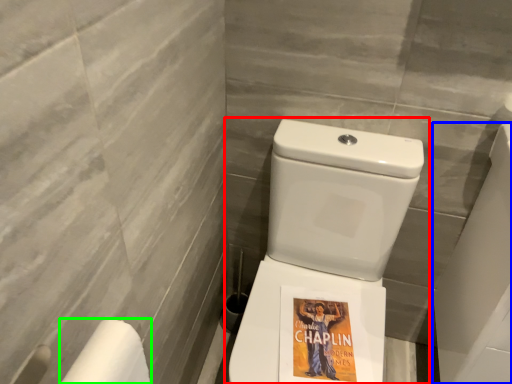
Question: Which object is the closest to the toilet (highlighted by a red box)? Choose among these: porcelain (highlighted by a blue box) or toilet paper (highlighted by a green box).

Choices:
 (A) porcelain
 (B) toilet paper

Answer: (A)